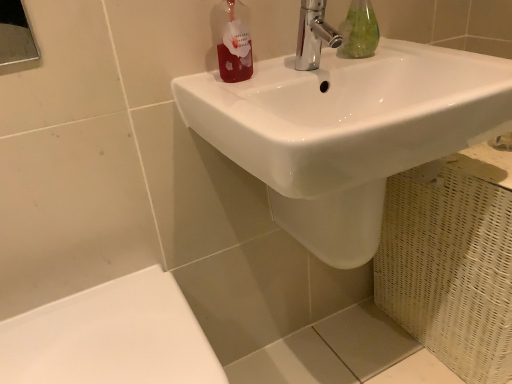
Question: Does white glossy sink at upper center have a larger size compared to white glossy porcelain at lower left?

Choices:
 (A) yes
 (B) no

Answer: (A)

Question: Does white glossy sink at upper center have a smaller size compared to white glossy porcelain at lower left?

Choices:
 (A) no
 (B) yes

Answer: (A)

Question: Is white glossy sink at upper center aimed at white glossy porcelain at lower left?

Choices:
 (A) no
 (B) yes

Answer: (A)

Question: Is white glossy sink at upper center not close to white glossy porcelain at lower left?

Choices:
 (A) no
 (B) yes

Answer: (A)

Question: Does white glossy sink at upper center appear on the left side of white glossy porcelain at lower left?

Choices:
 (A) no
 (B) yes

Answer: (A)

Question: Considering the positions of chrome/metallic faucet at upper center and white glossy porcelain at lower left in the image, is chrome/metallic faucet at upper center bigger or smaller than white glossy porcelain at lower left?

Choices:
 (A) small
 (B) big

Answer: (A)

Question: Is chrome/metallic faucet at upper center inside the boundaries of white glossy porcelain at lower left, or outside?

Choices:
 (A) inside
 (B) outside

Answer: (B)

Question: Looking at their shapes, would you say chrome/metallic faucet at upper center is wider or thinner than white glossy porcelain at lower left?

Choices:
 (A) thin
 (B) wide

Answer: (A)

Question: From a real-world perspective, is chrome/metallic faucet at upper center positioned above or below white glossy porcelain at lower left?

Choices:
 (A) below
 (B) above

Answer: (B)

Question: Based on their sizes in the image, would you say chrome/metallic faucet at upper center is bigger or smaller than white glossy sink at upper center?

Choices:
 (A) small
 (B) big

Answer: (A)

Question: Is point (308, 9) positioned closer to the camera than point (269, 193)?

Choices:
 (A) farther
 (B) closer

Answer: (B)

Question: Looking at their shapes, would you say chrome/metallic faucet at upper center is wider or thinner than white glossy sink at upper center?

Choices:
 (A) thin
 (B) wide

Answer: (A)

Question: Based on their positions, is chrome/metallic faucet at upper center located to the left or right of white glossy sink at upper center?

Choices:
 (A) right
 (B) left

Answer: (B)

Question: Considering the positions of translucent red bottle at upper center and white glossy porcelain at lower left in the image, is translucent red bottle at upper center taller or shorter than white glossy porcelain at lower left?

Choices:
 (A) tall
 (B) short

Answer: (B)

Question: Based on their sizes in the image, would you say translucent red bottle at upper center is bigger or smaller than white glossy porcelain at lower left?

Choices:
 (A) small
 (B) big

Answer: (A)